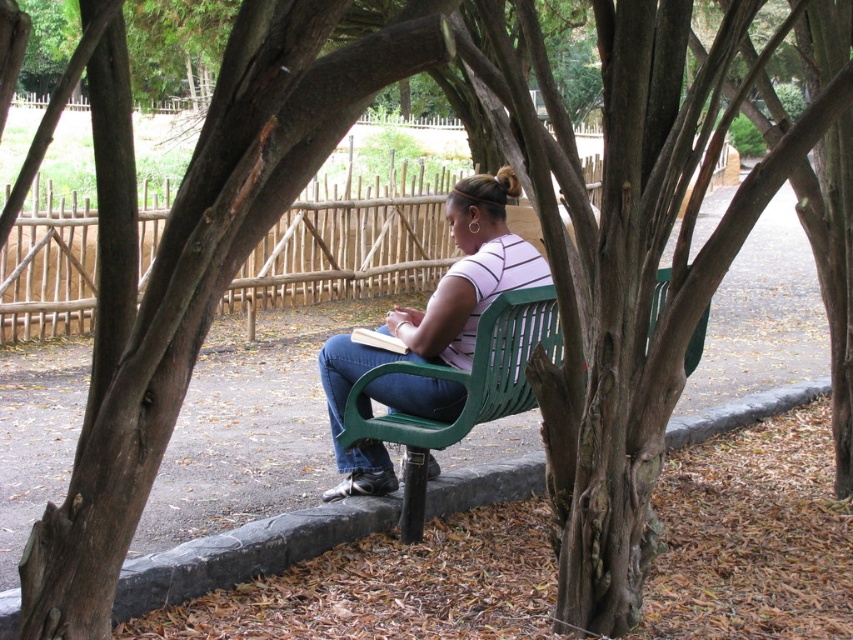
Can you confirm if matte green bench at center is shorter than green plastic bench at center?

In fact, matte green bench at center may be taller than green plastic bench at center.

Between point (425, 332) and point (344, 444), which one is positioned behind?

Point (344, 444)

I want to click on matte green bench at center, so click(x=434, y=317).